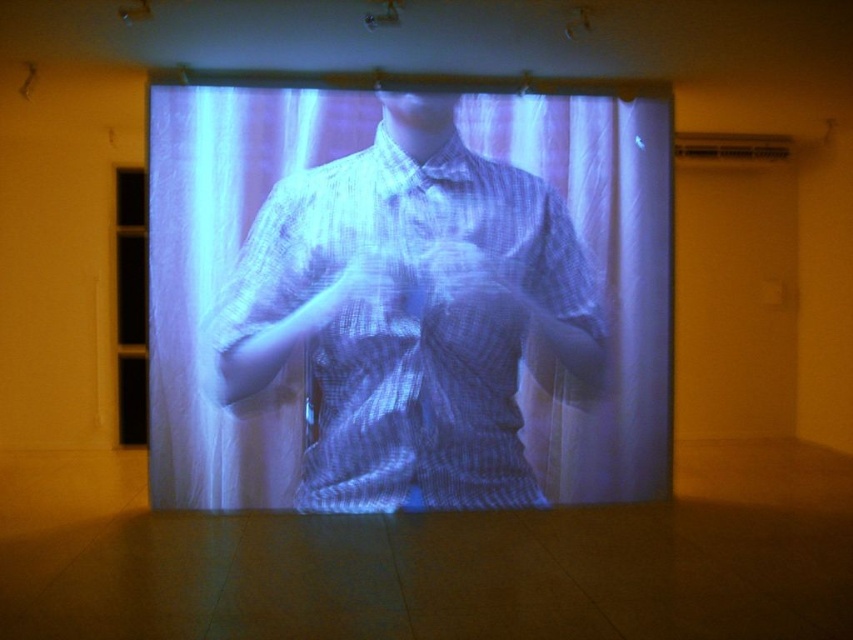
Which is behind, point (236, 380) or point (376, 285)?

The point (236, 380) is more distant.

Can you confirm if translucent white shirt at center is taller than translucent fabric hand at center?

Yes, translucent white shirt at center is taller than translucent fabric hand at center.

Is point (289, 273) closer to camera compared to point (418, 291)?

Yes, point (289, 273) is in front of point (418, 291).

This screenshot has height=640, width=853. I want to click on translucent white shirt at center, so click(x=410, y=316).